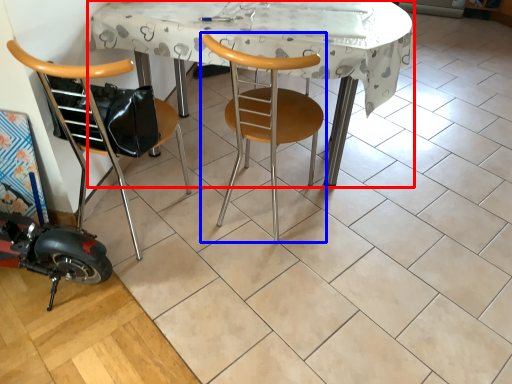
Question: Which of the following is the farthest to the observer, table (highlighted by a red box) or chair (highlighted by a blue box)?

Choices:
 (A) table
 (B) chair

Answer: (A)